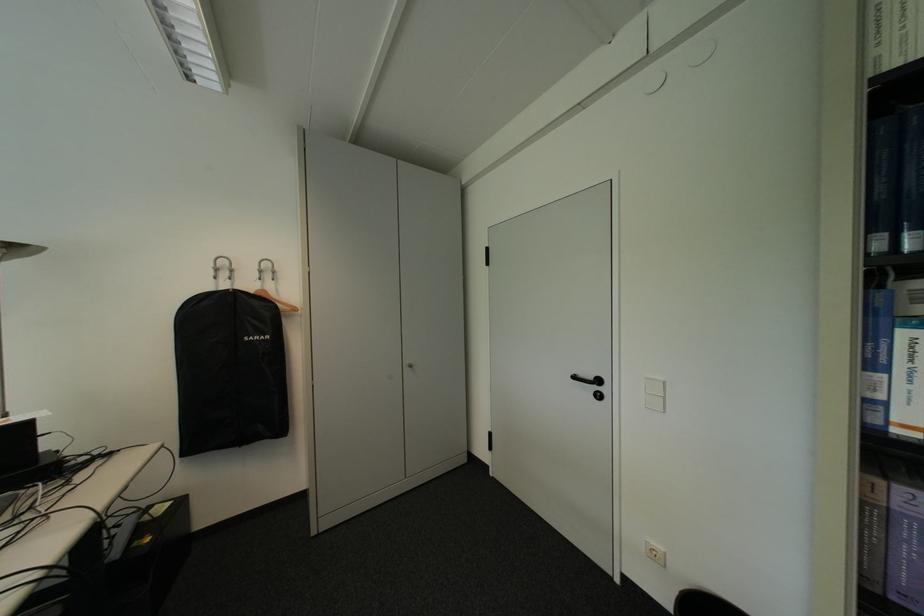
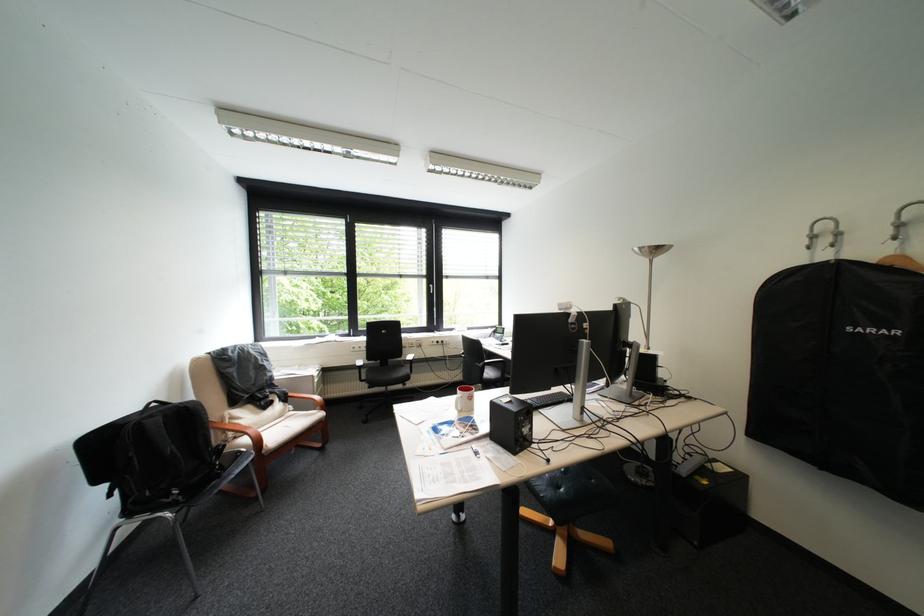
Where in the second image is the point corresponding to point 236,274 from the first image?

(837, 241)